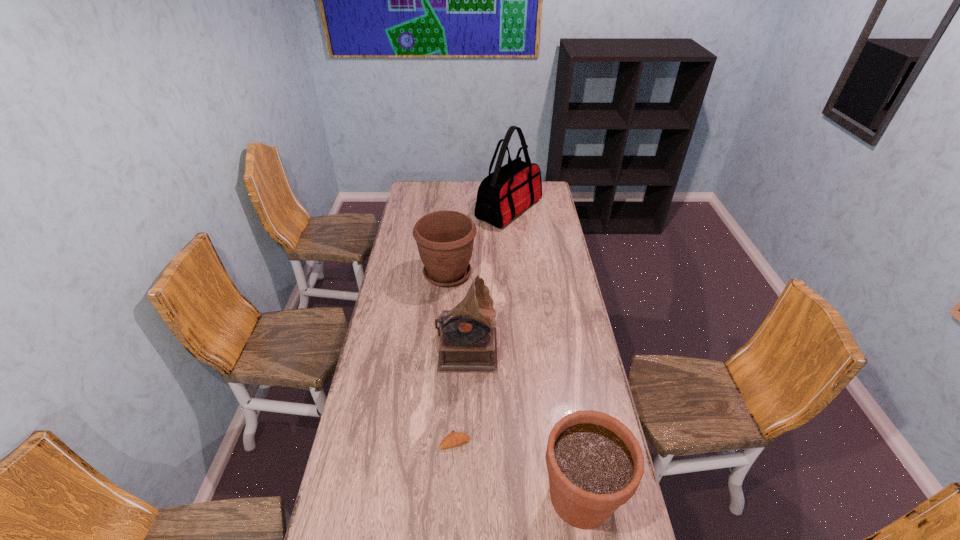
Image resolution: width=960 pixels, height=540 pixels. In order to click on the tallest object in this screenshot , I will do `click(508, 191)`.

I want to click on the farthest object, so click(x=508, y=191).

Find the location of a particular element. the third farthest object is located at coordinates (468, 344).

This screenshot has width=960, height=540. Identify the location of record player. (468, 344).

Where is `the left flowerpot`? The height and width of the screenshot is (540, 960). the left flowerpot is located at coordinates (445, 239).

The image size is (960, 540). In order to click on the second farthest object in this screenshot , I will do `click(445, 239)`.

Find the location of a particular element. The height and width of the screenshot is (540, 960). crescent roll is located at coordinates (453, 439).

Image resolution: width=960 pixels, height=540 pixels. What are the coordinates of `the shortest object` in the screenshot? It's located at (453, 439).

I want to click on vacant space located 0.190m on the left of the duffel bag, so click(442, 210).

Identify the location of vacant space situated 0.280m from the horn of the record player. (566, 344).